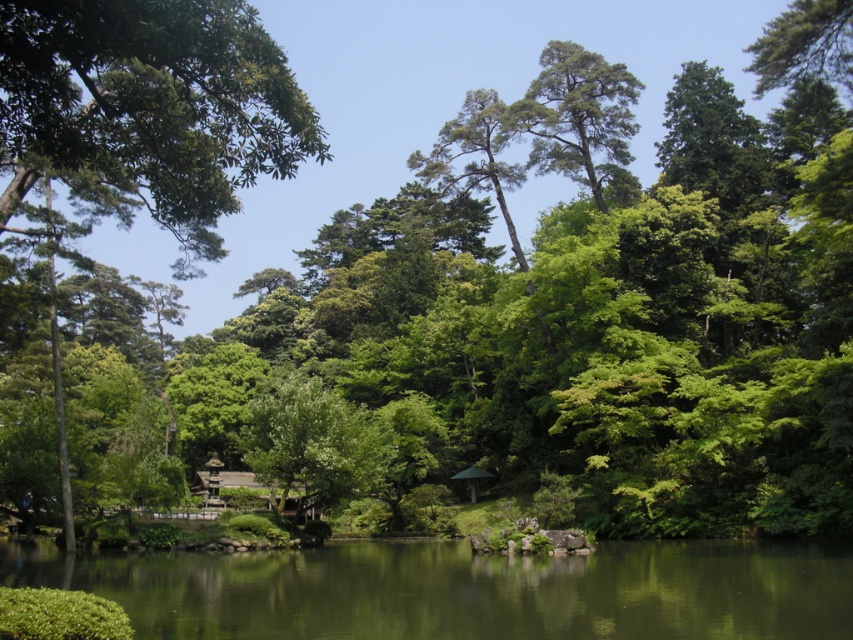
You are standing at the edge of the pond and want to place a small decorative rock exactly at the center of the green smooth water at center. According to the coordinates provided, where should you place the rock?

The green smooth water at center is located at coordinates point (463, 589), so you should place the rock at that exact point.

You are standing at the center of the pond and want to reach the green leafy tree at upper left. Which direction should you head towards?

The green leafy tree at upper left is located at point (148, 109), so you should head towards the upper left direction to reach it.